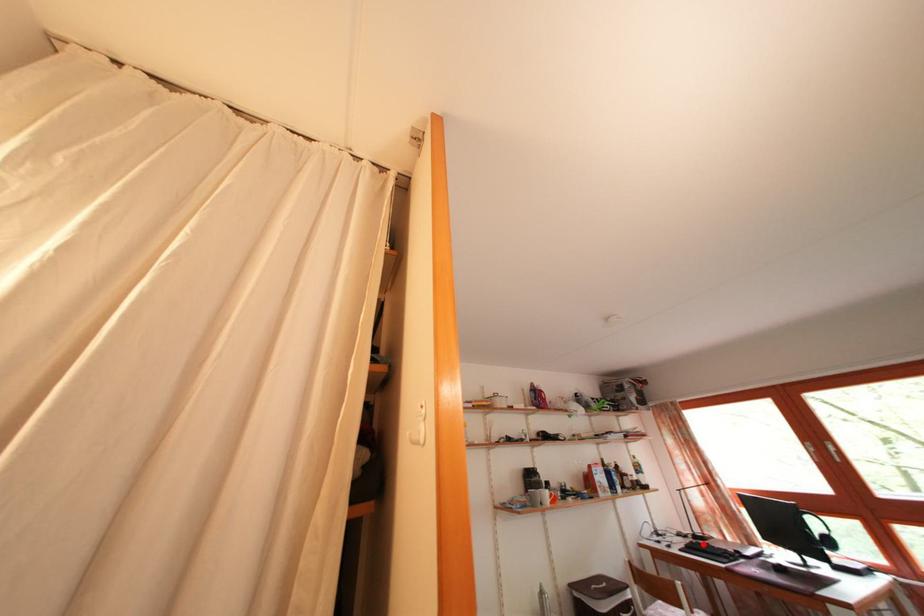
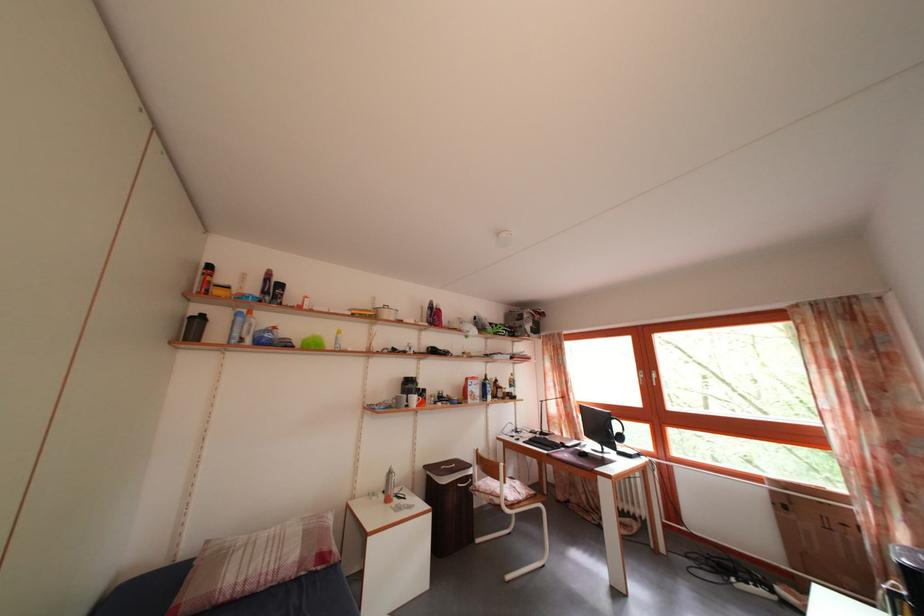
Find the pixel in the second image that matches the highlighted location in the first image.

(550, 440)